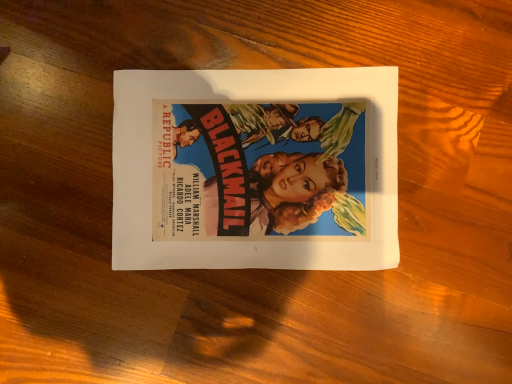
At what (x,y) coordinates should I click in order to perform the action: click on matte paper poster at center. Please return your answer as a coordinate pair (x, y). Looking at the image, I should click on (255, 169).

The image size is (512, 384). Describe the element at coordinates (255, 169) in the screenshot. I see `matte paper poster at center` at that location.

This screenshot has width=512, height=384. I want to click on matte paper poster at center, so click(255, 169).